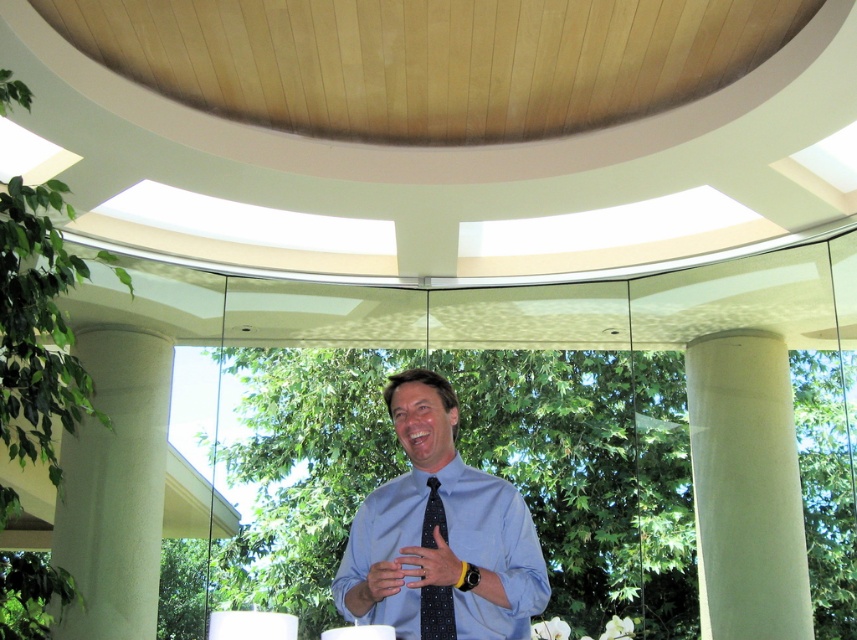
Question: Can you confirm if white smooth column at center is positioned to the right of white smooth column at left?

Choices:
 (A) no
 (B) yes

Answer: (B)

Question: Among these points, which one is farthest from the camera?

Choices:
 (A) (387, 593)
 (B) (418, 572)
 (C) (378, 541)

Answer: (C)

Question: Which point is farther from the camera taking this photo?

Choices:
 (A) (691, 356)
 (B) (426, 536)
 (C) (474, 508)

Answer: (A)

Question: Which point appears farthest from the camera in this image?

Choices:
 (A) (400, 586)
 (B) (153, 618)
 (C) (423, 588)
 (D) (423, 634)

Answer: (B)

Question: Considering the relative positions of white smooth column at left and smooth skin hand at center in the image provided, where is white smooth column at left located with respect to smooth skin hand at center?

Choices:
 (A) below
 (B) above

Answer: (A)

Question: Can you confirm if blue polka dot tie at center is positioned to the left of white smooth column at center?

Choices:
 (A) yes
 (B) no

Answer: (A)